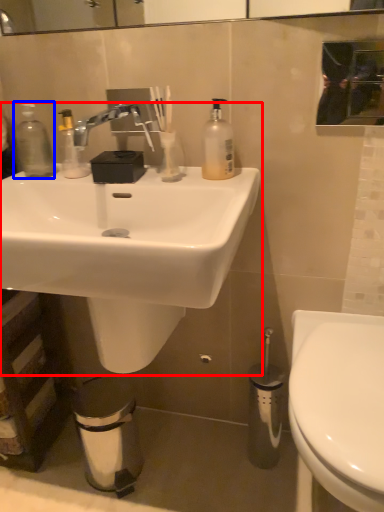
Question: Which point is closer to the camera, sink (highlighted by a red box) or bottle (highlighted by a blue box)?

Choices:
 (A) sink
 (B) bottle

Answer: (A)